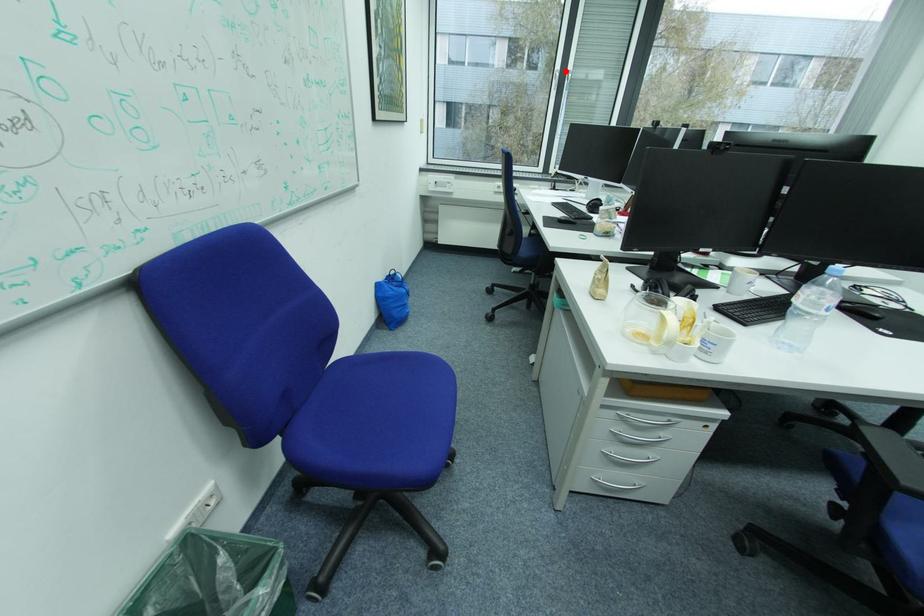
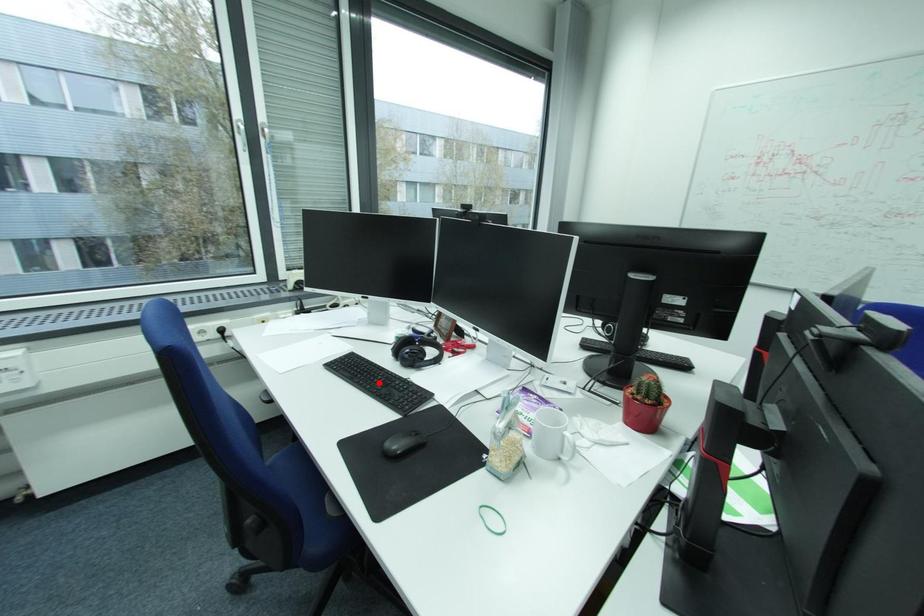
I am providing you with two images of the same scene from different viewpoints. A red point is marked on the first image and another point is marked on the second image. Is the red point in image1 aligned with the point shown in image2?

No